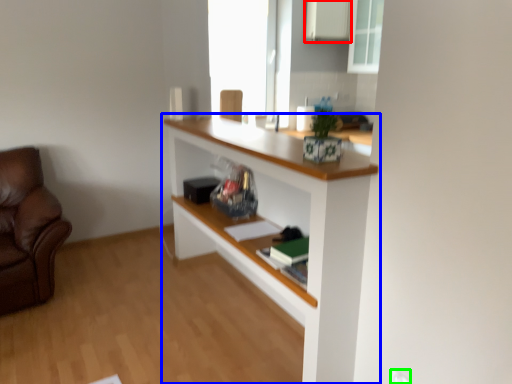
Question: Which object is positioned farthest from cabinetry (highlighted by a red box)? Select from shelf (highlighted by a blue box) and electric outlet (highlighted by a green box).

Choices:
 (A) shelf
 (B) electric outlet

Answer: (B)